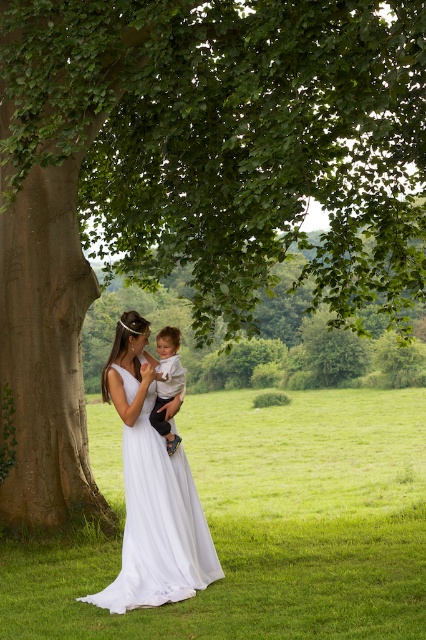
This screenshot has width=426, height=640. Identify the location of white chiffon dress at center. (158, 524).

Who is lower down, white chiffon dress at center or white cotton shirt at center?

Positioned lower is white chiffon dress at center.

Measure the distance between white chiffon dress at center and camera.

white chiffon dress at center is 8.19 meters from camera.

At what (x,y) coordinates should I click in order to perform the action: click on white chiffon dress at center. Please return your answer as a coordinate pair (x, y). This screenshot has height=640, width=426. Looking at the image, I should click on (158, 524).